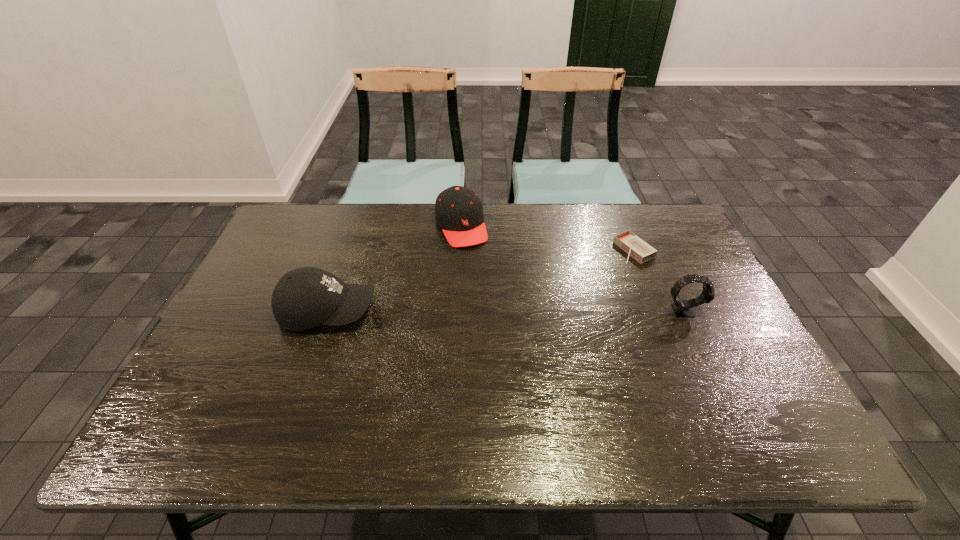
Where is `free space located 0.290m on the striking surface of the matchbox`? Image resolution: width=960 pixels, height=540 pixels. free space located 0.290m on the striking surface of the matchbox is located at coordinates (545, 291).

At what (x,y) coordinates should I click in order to perform the action: click on cap that is at the far edge. Please return your answer as a coordinate pair (x, y). Looking at the image, I should click on (458, 210).

What are the coordinates of `matchbox at the far edge` in the screenshot? It's located at (637, 248).

You are a GUI agent. You are given a task and a screenshot of the screen. Output one action in this format:
    pyautogui.click(x=<x>, y=<y>)
    Task: Click on the object at the left edge
    
    Given the screenshot: What is the action you would take?
    pyautogui.click(x=303, y=298)

Identify the location of watch at the right edge. (683, 308).

Where is `matchbox that is at the right edge`? matchbox that is at the right edge is located at coordinates (637, 248).

Identify the location of object located in the far right corner section of the desktop. (637, 248).

This screenshot has height=540, width=960. Find the location of `vacant space at the far edge of the desktop`. vacant space at the far edge of the desktop is located at coordinates (399, 209).

Identify the location of free space at the near edge of the desktop. (650, 395).

The width and height of the screenshot is (960, 540). In the image, there is a desktop. What are the coordinates of `vacant space at the left edge` in the screenshot? It's located at (306, 254).